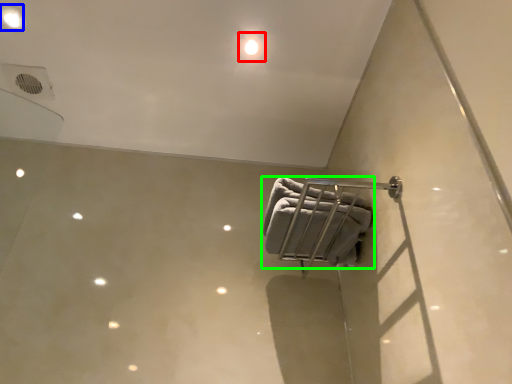
Question: Estimate the real-world distances between objects in this image. Which object is closer to dot (highlighted by a red box), dot (highlighted by a blue box) or towel (highlighted by a green box)?

Choices:
 (A) dot
 (B) towel

Answer: (B)